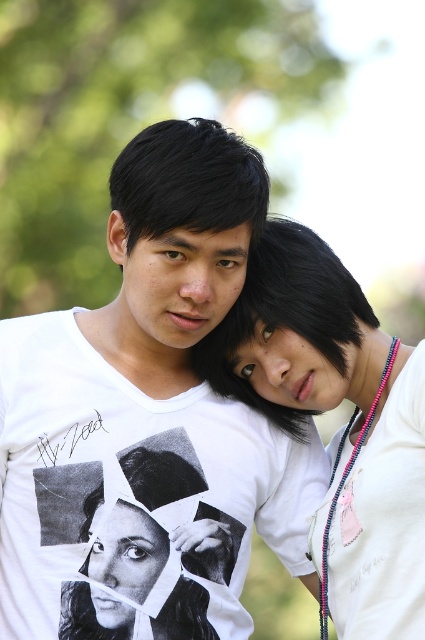
Question: In this image, where is white printed t-shirt at center located relative to white matte necklace at upper right?

Choices:
 (A) above
 (B) below

Answer: (A)

Question: Does white printed t-shirt at center appear on the right side of white matte necklace at upper right?

Choices:
 (A) yes
 (B) no

Answer: (B)

Question: Is white printed t-shirt at center smaller than white matte necklace at upper right?

Choices:
 (A) yes
 (B) no

Answer: (B)